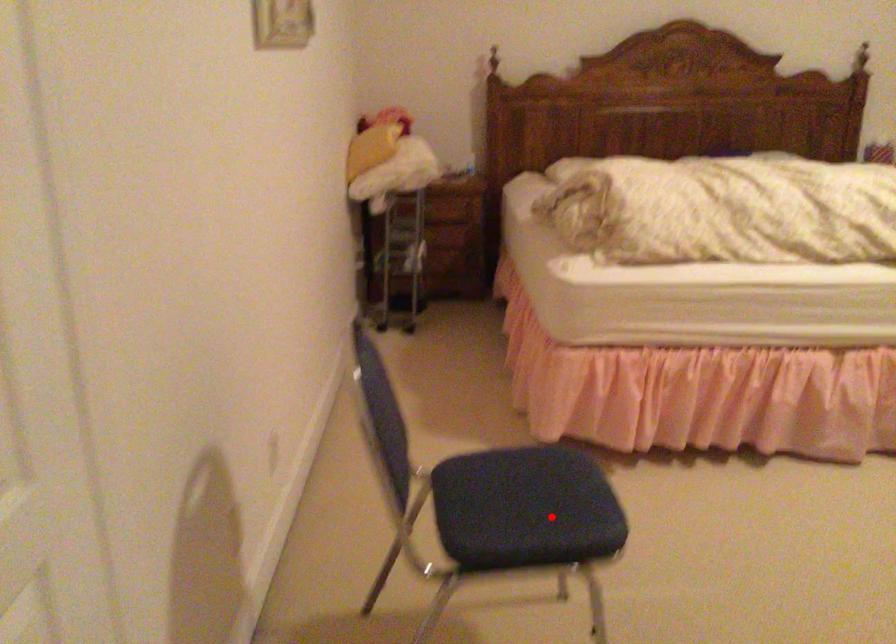
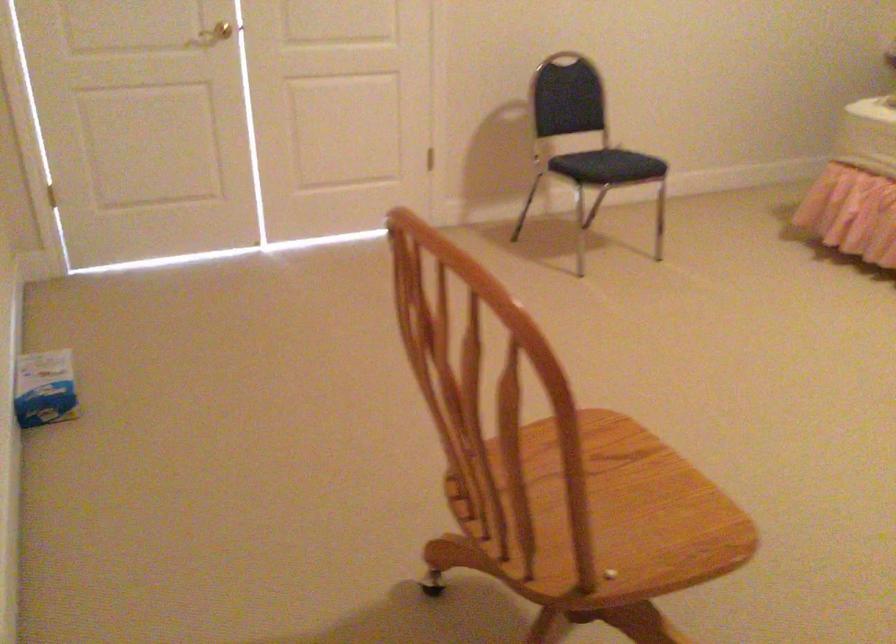
In the second image, find the point that corresponds to the highlighted location in the first image.

(607, 166)